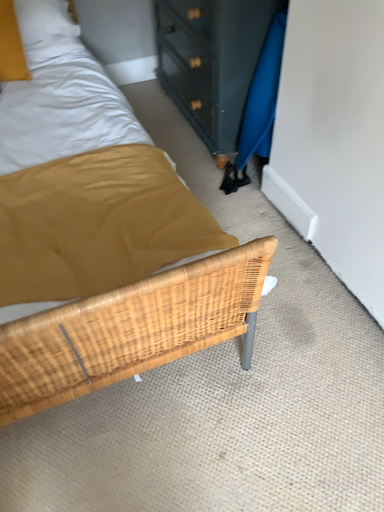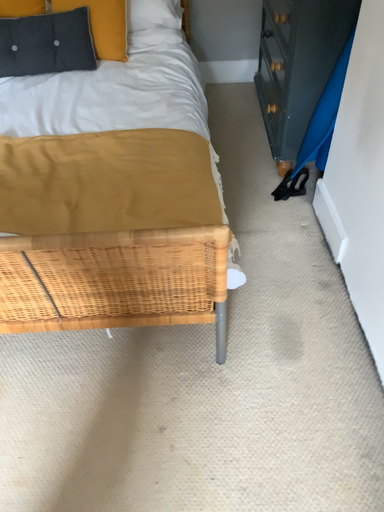
Question: Which way did the camera rotate in the video?

Choices:
 (A) rotated right
 (B) rotated left

Answer: (B)